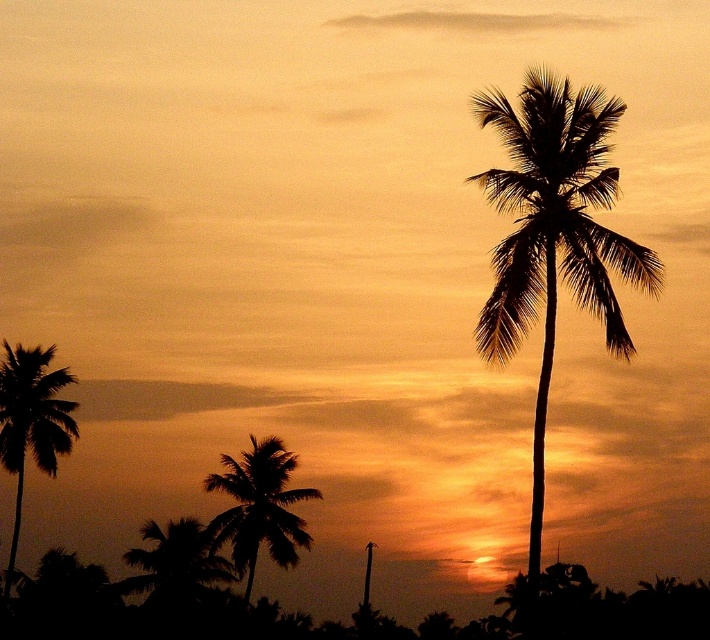
Between silhouette palm at right and silhouette leafy palm at lower center, which one is positioned higher?

silhouette palm at right is higher up.

Can you confirm if silhouette palm at right is taller than silhouette leafy palm at lower center?

Indeed, silhouette palm at right has a greater height compared to silhouette leafy palm at lower center.

Who is more distant from viewer, [562,182] or [278,458]?

The point [278,458] is behind.

I want to click on silhouette palm at right, so point(552,236).

Between silhouette palm at right and silhouette palm tree at left, which one appears on the right side from the viewer's perspective?

From the viewer's perspective, silhouette palm at right appears more on the right side.

Who is higher up, silhouette palm at right or silhouette palm tree at left?

silhouette palm at right is higher up.

Identify the location of silhouette palm at right. (552, 236).

Which of these two, silhouette leafy palm at lower center or silhouette palm tree at left, stands taller?

Standing taller between the two is silhouette palm tree at left.

Who is more distant from viewer, [290,516] or [31,394]?

The point [290,516] is behind.

Where is `silhouette leafy palm at lower center`? The height and width of the screenshot is (640, 710). silhouette leafy palm at lower center is located at coordinates (258, 508).

This screenshot has height=640, width=710. I want to click on silhouette leafy palm at lower center, so click(x=258, y=508).